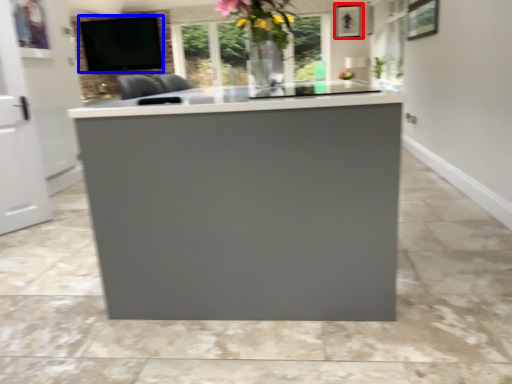
Question: Which object appears farthest to the camera in this image, picture frame (highlighted by a red box) or window screen (highlighted by a blue box)?

Choices:
 (A) picture frame
 (B) window screen

Answer: (B)